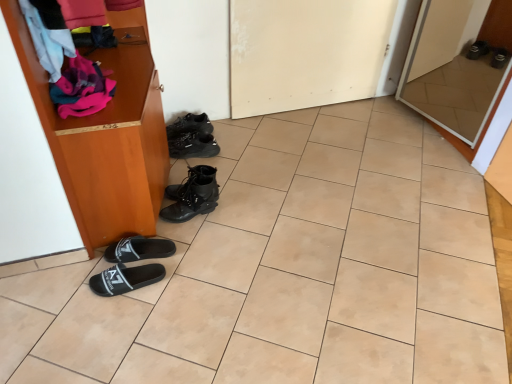
Question: Which direction should I rotate to look at white matte door at center, which is the 1th door from left to right, — up or down?

Choices:
 (A) up
 (B) down

Answer: (A)

Question: Should I look upward or downward to see black fabric slipper at lower left, the fifth footwear in the back-to-front sequence?

Choices:
 (A) up
 (B) down

Answer: (B)

Question: From a real-world perspective, is beige tile at center on white matte door at center, the second door positioned from the right?

Choices:
 (A) yes
 (B) no

Answer: (B)

Question: Does beige tile at center have a smaller size compared to white matte door at center, the second door positioned from the right?

Choices:
 (A) no
 (B) yes

Answer: (A)

Question: Does beige tile at center have a lesser height compared to white matte door at center, which is the 1th door from left to right?

Choices:
 (A) no
 (B) yes

Answer: (B)

Question: Is beige tile at center facing towards white matte door at center, which is the 1th door from left to right?

Choices:
 (A) yes
 (B) no

Answer: (B)

Question: Is beige tile at center directly adjacent to white matte door at center, which is the 1th door from left to right?

Choices:
 (A) yes
 (B) no

Answer: (B)

Question: Are beige tile at center and white matte door at center, the second door positioned from the right, located far from each other?

Choices:
 (A) yes
 (B) no

Answer: (B)

Question: From a real-world perspective, is black leather sneakers at center, the second footwear in the back-to-front sequence, positioned over beige tile at center based on gravity?

Choices:
 (A) yes
 (B) no

Answer: (A)

Question: Can beige tile at center be found inside black leather sneakers at center, acting as the 4th footwear starting from the front?

Choices:
 (A) yes
 (B) no

Answer: (B)

Question: Is black leather sneakers at center, which appears as the 2th footwear when viewed from the top, not near beige tile at center?

Choices:
 (A) no
 (B) yes

Answer: (A)

Question: Are black leather sneakers at center, acting as the 4th footwear starting from the front, and beige tile at center beside each other?

Choices:
 (A) no
 (B) yes

Answer: (A)

Question: Does black leather sneakers at center, the 4th footwear positioned from the bottom, have a greater width compared to beige tile at center?

Choices:
 (A) yes
 (B) no

Answer: (B)

Question: Is black leather sneakers at center, the second footwear in the back-to-front sequence, at the right side of beige tile at center?

Choices:
 (A) no
 (B) yes

Answer: (A)

Question: Does black leather sneakers at center, which ranks as the 1th footwear in top-to-bottom order, appear on the right side of beige tile at center?

Choices:
 (A) yes
 (B) no

Answer: (B)